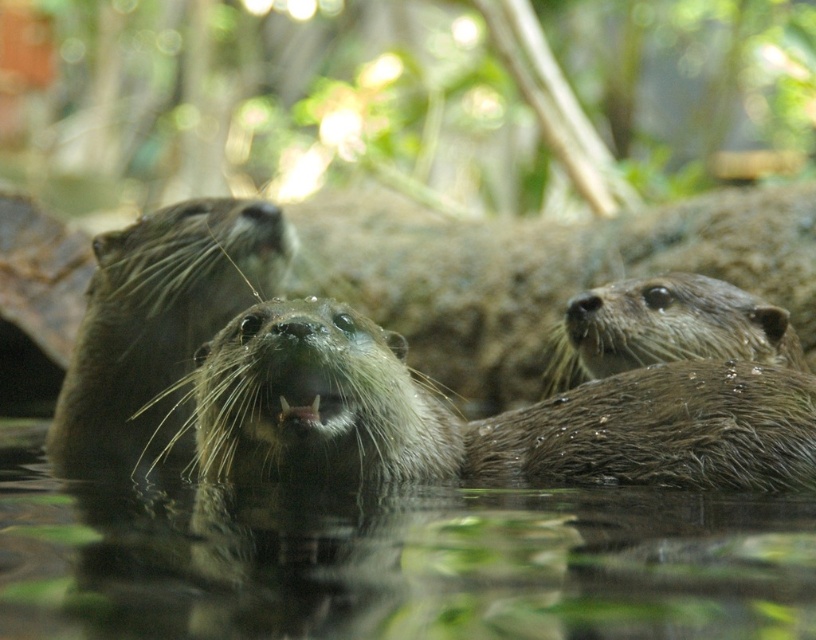
Is clear water at center to the right of fuzzy brown otter at center from the viewer's perspective?

Incorrect, clear water at center is not on the right side of fuzzy brown otter at center.

Is point (246, 596) less distant than point (657, 417)?

That is True.

Which is behind, point (7, 461) or point (429, 440)?

The point (7, 461) is behind.

Where is `clear water at center`? The height and width of the screenshot is (640, 816). clear water at center is located at coordinates (393, 563).